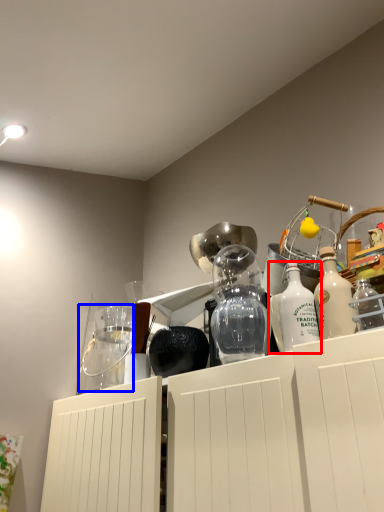
Question: Which of the following is the farthest to the observer, bottle (highlighted by a red box) or glass jar (highlighted by a blue box)?

Choices:
 (A) bottle
 (B) glass jar

Answer: (B)